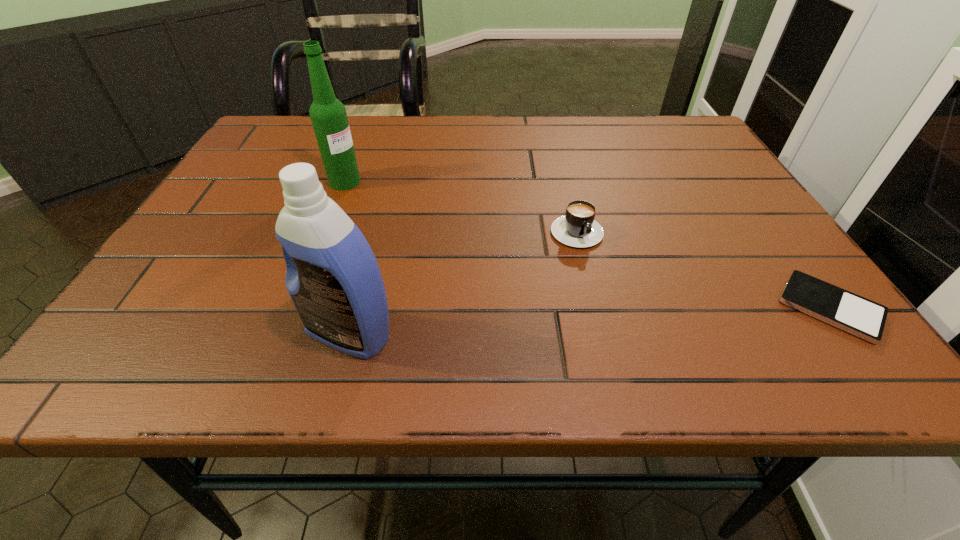
Find the location of a particular element. The width and height of the screenshot is (960, 540). free space on the desktop that is between the detergent and the shortest object and is positioned with the handle on the side of the second object from right to left is located at coordinates (627, 319).

Where is `free space on the desktop that is between the detergent and the iPod and is positioned on the label of the farthest object`? This screenshot has height=540, width=960. free space on the desktop that is between the detergent and the iPod and is positioned on the label of the farthest object is located at coordinates (663, 316).